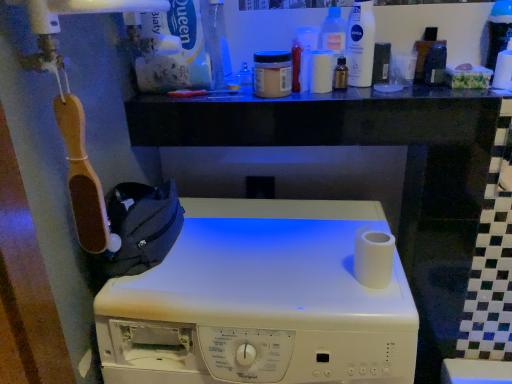
Locate an element on the screen. This screenshot has height=384, width=512. blank area to the left of matte black container at upper right, which is counted as the sixth toiletry, starting from the left is located at coordinates (376, 94).